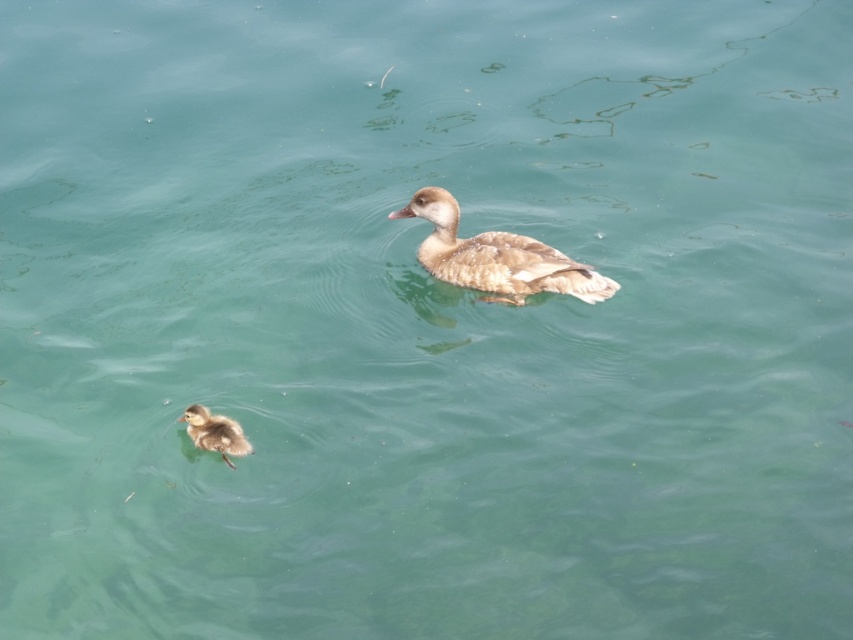
You are standing at the edge of the water and see the brown fuzzy duckling at center. If you want to throw a small pebble to the exact location where the duckling is currently swimming, what are the coordinates you should aim for?

You should aim for the coordinates point (496, 257) where the brown fuzzy duckling at center is located.

From the picture: You are standing at the edge of the water and see a point marked at coordinates [496,257]. Based on the scene description, what object is located at that point?

The point at coordinates [496,257] is located on the brown fuzzy duckling at center.

You are a wildlife photographer aiming to capture both the brown fuzzy duckling at center and the brown fluffy duckling at lower left in a single frame. Based on their positions and sizes, which duckling should you focus on first to ensure both are in the shot?

The brown fluffy duckling at lower left is smaller in size, so focusing on the brown fuzzy duckling at center first will allow you to frame the shot to include both.